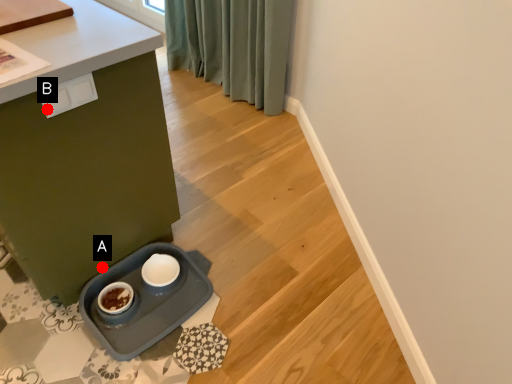
Question: Two points are circled on the image, labeled by A and B beside each circle. Which point is further to the camera?

Choices:
 (A) A is further
 (B) B is further

Answer: (A)